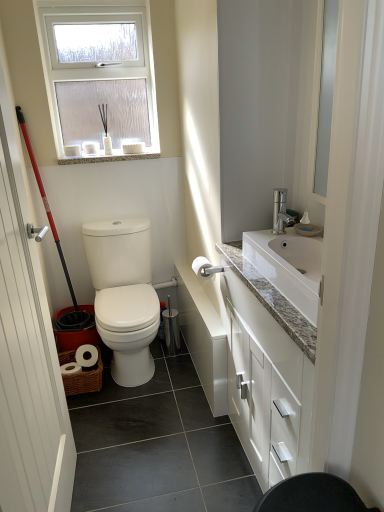
Question: Relative to white matte toilet paper at center, is white glossy cabinet at right in front or behind?

Choices:
 (A) behind
 (B) front

Answer: (B)

Question: From a real-world perspective, is white glossy cabinet at right physically located above or below white matte toilet paper at center?

Choices:
 (A) below
 (B) above

Answer: (A)

Question: Which object is positioned closest to the white wooden door at left?

Choices:
 (A) white matte toilet paper at center
 (B) white frosted glass window at upper center
 (C) white glossy cabinet at right
 (D) white glossy toilet at center-left

Answer: (C)

Question: Estimate the real-world distances between objects in this image. Which object is closer to the white glossy cabinet at right?

Choices:
 (A) white wooden door at left
 (B) white frosted glass window at upper center
 (C) white glossy toilet at center-left
 (D) white matte toilet paper at center

Answer: (D)